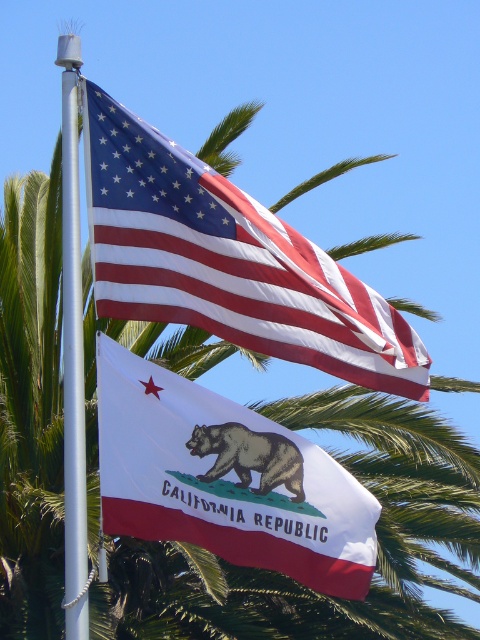
Question: Does matte cotton flag at upper center have a larger size compared to white fabric flag at center?

Choices:
 (A) no
 (B) yes

Answer: (A)

Question: Can you confirm if white fabric flag at center is smaller than white metallic pole at left?

Choices:
 (A) yes
 (B) no

Answer: (A)

Question: Which point is closer to the camera taking this photo?

Choices:
 (A) (66, 540)
 (B) (336, 592)

Answer: (A)

Question: Which point is closer to the camera taking this photo?

Choices:
 (A) (331, 531)
 (B) (73, 390)

Answer: (B)

Question: Which is farther from the white fabric flag at center?

Choices:
 (A) white metallic pole at left
 (B) matte cotton flag at upper center

Answer: (B)

Question: Is matte cotton flag at upper center smaller than white metallic pole at left?

Choices:
 (A) yes
 (B) no

Answer: (A)